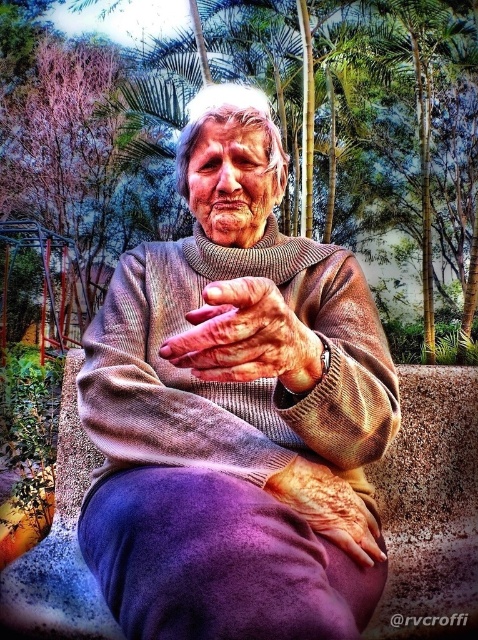
Who is shorter, knitted sweater at center or green leafy tree at center?

knitted sweater at center

How distant is knitted sweater at center from green leafy tree at center?

knitted sweater at center is 7.75 feet away from green leafy tree at center.

The width and height of the screenshot is (478, 640). What are the coordinates of `knitted sweater at center` in the screenshot? It's located at (236, 410).

You are a GUI agent. You are given a task and a screenshot of the screen. Output one action in this format:
    pyautogui.click(x=<x>, y=<y>)
    Task: Click on the knitted sweater at center
    Image resolution: width=478 pixels, height=640 pixels.
    Given the screenshot: What is the action you would take?
    pyautogui.click(x=236, y=410)

Between knitted sweater at center and dry skin at center, which one is positioned lower?

dry skin at center

From the picture: Does knitted sweater at center appear on the left side of dry skin at center?

Correct, you'll find knitted sweater at center to the left of dry skin at center.

Where is `knitted sweater at center`? This screenshot has width=478, height=640. knitted sweater at center is located at coordinates (236, 410).

Identify the location of knitted sweater at center. The height and width of the screenshot is (640, 478). (236, 410).

Does purple soft fabric at center appear under dry skin at center?

Yes.

Between point (116, 596) and point (345, 550), which one is positioned in front?

Point (116, 596) is more forward.

I want to click on purple soft fabric at center, so click(x=217, y=561).